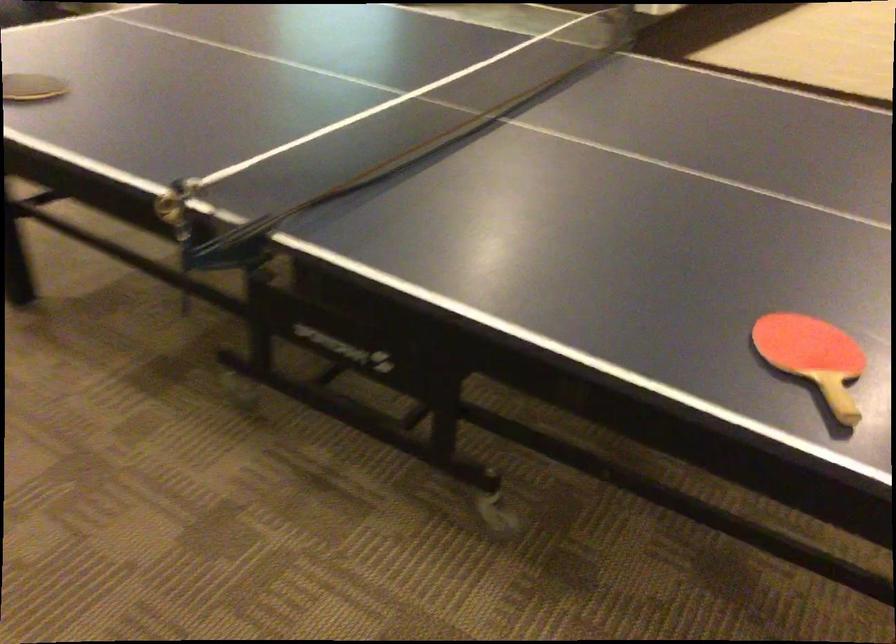
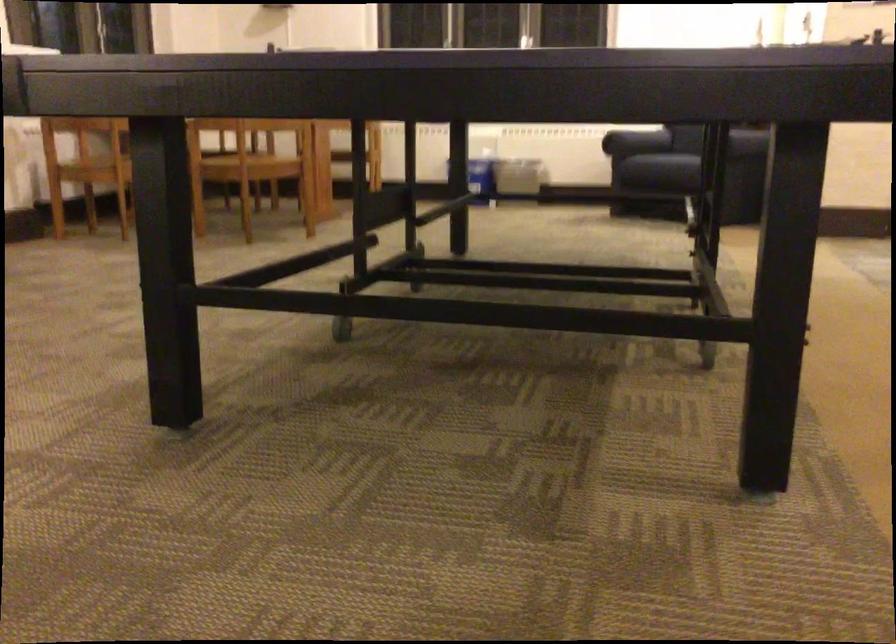
Question: I am providing you with two images of the same scene from different viewpoints. Which of the following objects are not visible in image2?

Choices:
 (A) sofa armrest
 (B) sofa sitting surface
 (C) table caster wheel
 (D) brown drink bottle

Answer: (C)